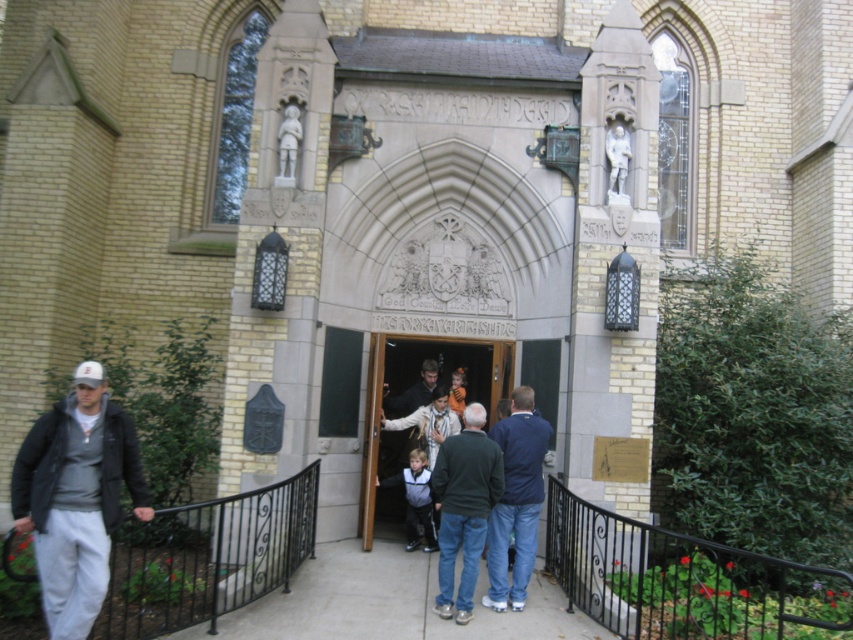
Question: Is dark green sweater at center above matte stone door at center?

Choices:
 (A) no
 (B) yes

Answer: (B)

Question: Which point appears farthest from the camera in this image?

Choices:
 (A) click(x=426, y=547)
 (B) click(x=498, y=608)
 (C) click(x=480, y=506)
 (D) click(x=19, y=518)

Answer: (A)

Question: Does matte black jacket at left lie behind dark green sweater at center?

Choices:
 (A) yes
 (B) no

Answer: (B)

Question: Which point appears closest to the camera in this image?

Choices:
 (A) (393, 433)
 (B) (74, 596)

Answer: (B)

Question: Among these objects, which one is nearest to the camera?

Choices:
 (A) matte stone door at center
 (B) dark blue jacket at center
 (C) matte black jacket at left
 (D) blue denim jeans at center

Answer: (C)

Question: Is blue denim jeans at center thinner than matte stone door at center?

Choices:
 (A) no
 (B) yes

Answer: (A)